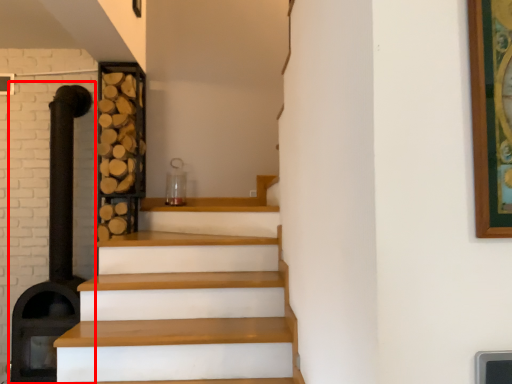
Question: Where is fireplace (annotated by the red box) located in relation to shelf in the image?

Choices:
 (A) right
 (B) left

Answer: (B)